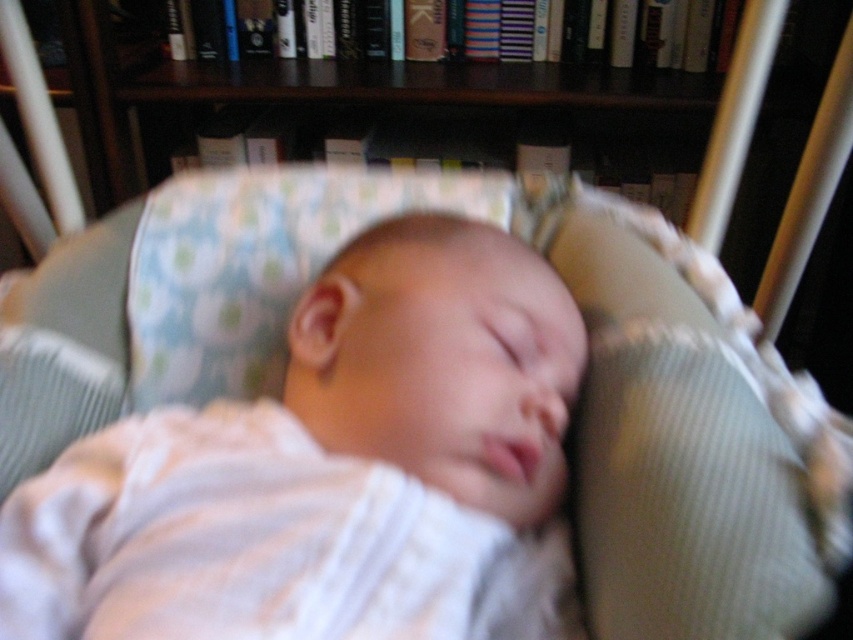
Question: Does white knit fabric baby at center have a lesser width compared to green ribbed pillow at right?

Choices:
 (A) no
 (B) yes

Answer: (A)

Question: Which point is farther to the camera?

Choices:
 (A) green ribbed pillow at right
 (B) white knit fabric baby at center

Answer: (A)

Question: Can you confirm if white knit fabric baby at center is positioned to the left of green ribbed pillow at right?

Choices:
 (A) yes
 (B) no

Answer: (A)

Question: Can you confirm if white knit fabric baby at center is smaller than green ribbed pillow at right?

Choices:
 (A) no
 (B) yes

Answer: (A)